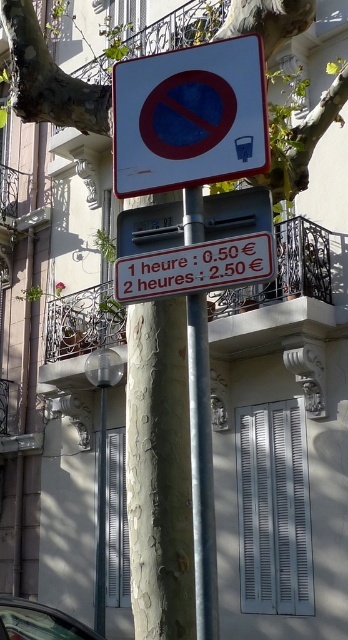
You are a pedestrian looking at the white plastic sign at upper center and the silver metallic pole at center. Which object is shorter?

The white plastic sign at upper center is shorter than the silver metallic pole at center.

You are a tourist in a European city and see the white plastic sign at upper center and the metallic silver car at lower left. Which object appears larger in the image?

The white plastic sign at upper center is bigger than the metallic silver car at lower left.